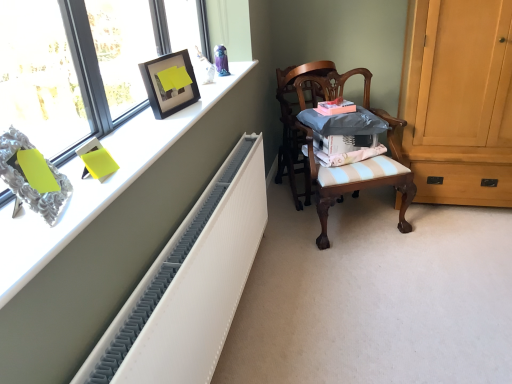
Locate an element on the screen. vacant area situated below wooden chair at center, placed as the 1th chair when sorted from front to back (from a real-world perspective) is located at coordinates (354, 220).